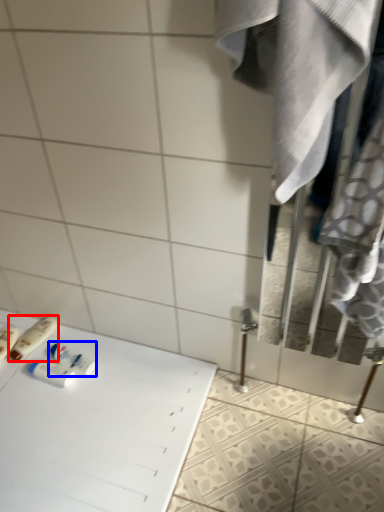
Question: Among these objects, which one is farthest to the camera, toiletry (highlighted by a red box) or mouthwash (highlighted by a blue box)?

Choices:
 (A) toiletry
 (B) mouthwash

Answer: (A)